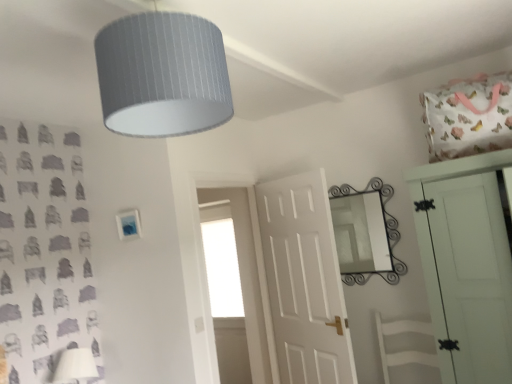
Question: Is white matte door at upper right, placed as the first door when sorted from front to back, closer to the viewer compared to textured gray lampshade at upper center?

Choices:
 (A) yes
 (B) no

Answer: (B)

Question: Is white matte door at upper right, which appears as the 2th door when viewed from the left, shorter than textured gray lampshade at upper center?

Choices:
 (A) yes
 (B) no

Answer: (B)

Question: Is white matte door at upper right, placed as the first door when sorted from front to back, at the left side of textured gray lampshade at upper center?

Choices:
 (A) yes
 (B) no

Answer: (B)

Question: Is white matte door at upper right, placed as the first door when sorted from front to back, at the right side of textured gray lampshade at upper center?

Choices:
 (A) no
 (B) yes

Answer: (B)

Question: From a real-world perspective, is white matte door at upper right, placed as the first door when sorted from front to back, positioned under textured gray lampshade at upper center based on gravity?

Choices:
 (A) yes
 (B) no

Answer: (A)

Question: From the image's perspective, is white matte door at upper right, placed as the first door when sorted from front to back, located above textured gray lampshade at upper center?

Choices:
 (A) yes
 (B) no

Answer: (B)

Question: Is white matte swivel chair at center to the left of transparent glass window at center from the viewer's perspective?

Choices:
 (A) yes
 (B) no

Answer: (B)

Question: Considering the relative sizes of white matte swivel chair at center and transparent glass window at center in the image provided, is white matte swivel chair at center taller than transparent glass window at center?

Choices:
 (A) no
 (B) yes

Answer: (A)

Question: Does white matte swivel chair at center have a greater width compared to transparent glass window at center?

Choices:
 (A) no
 (B) yes

Answer: (B)

Question: Does white matte swivel chair at center have a lesser height compared to transparent glass window at center?

Choices:
 (A) no
 (B) yes

Answer: (B)

Question: Is white matte swivel chair at center in front of transparent glass window at center?

Choices:
 (A) yes
 (B) no

Answer: (A)

Question: Is white matte swivel chair at center beside transparent glass window at center?

Choices:
 (A) no
 (B) yes

Answer: (A)

Question: Is the surface of white matte door at center, placed as the second door when sorted from front to back, in direct contact with textured gray lampshade at upper center?

Choices:
 (A) yes
 (B) no

Answer: (B)